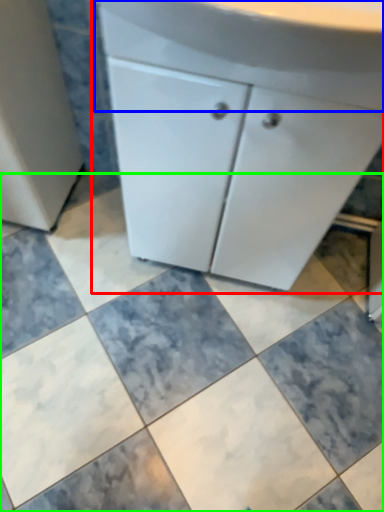
Question: Which object is positioned farthest from bathroom cabinet (highlighted by a red box)? Select from counter top (highlighted by a blue box) and ceramic tile (highlighted by a green box).

Choices:
 (A) counter top
 (B) ceramic tile

Answer: (B)